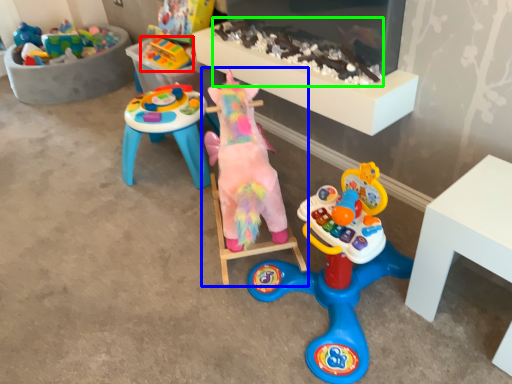
Question: Based on their relative distances, which object is nearer to toy (highlighted by a red box)? Choose from toy (highlighted by a blue box) and toy (highlighted by a green box).

Choices:
 (A) toy
 (B) toy

Answer: (B)